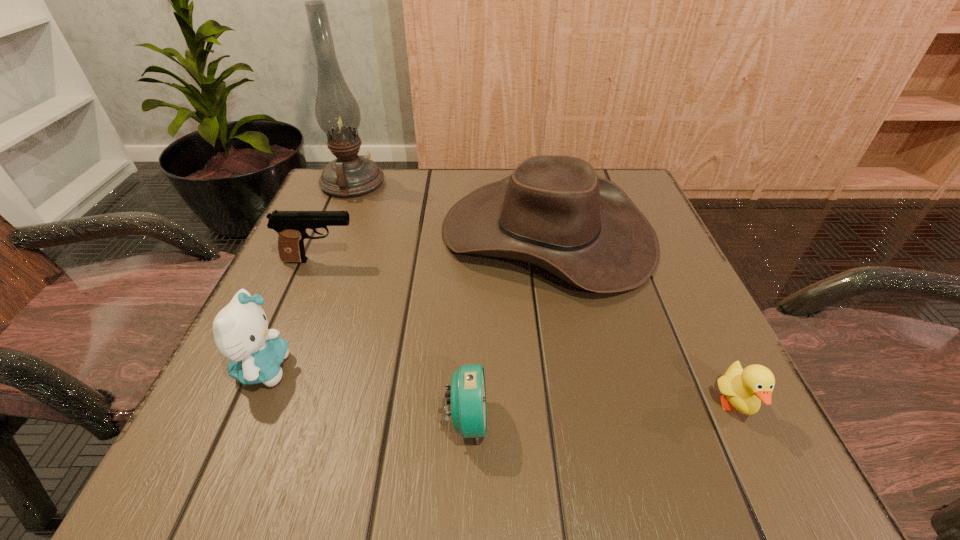
The height and width of the screenshot is (540, 960). In order to click on free space that satisfies the following two spatial constraints: 1. on the front-facing side of the duckling; 2. on the front-facing side of the alarm clock in this screenshot , I will do `click(742, 420)`.

What are the coordinates of `free space that satisfies the following two spatial constraints: 1. on the front side of the cowboy hat; 2. on the front-facing side of the alarm clock` in the screenshot? It's located at (583, 420).